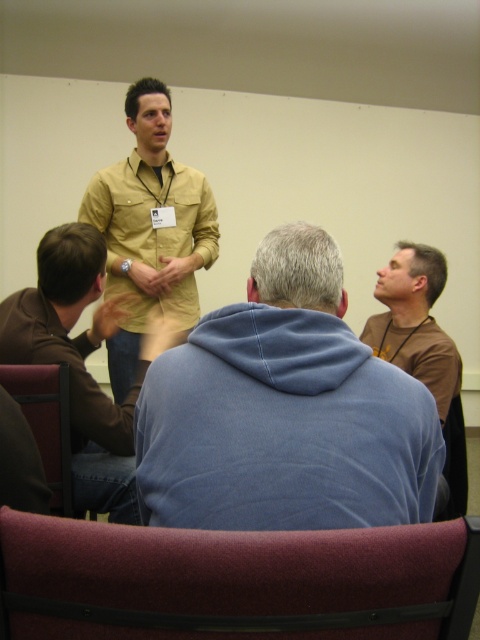
Question: Which of the following is the farthest from the observer?

Choices:
 (A) (22, 394)
 (B) (197, 362)
 (C) (443, 433)

Answer: (C)

Question: Can you confirm if matte khaki shirt at upper center is smaller than maroon fabric chair at lower right?

Choices:
 (A) yes
 (B) no

Answer: (B)

Question: Is blue fleece jacket at center positioned behind brown matte shirt at upper right?

Choices:
 (A) yes
 (B) no

Answer: (B)

Question: Is brown leather jacket at upper left behind brown matte shirt at upper right?

Choices:
 (A) no
 (B) yes

Answer: (A)

Question: Which object appears closest to the camera in this image?

Choices:
 (A) blue fleece jacket at center
 (B) maroon fabric chair at lower right
 (C) matte khaki shirt at upper center

Answer: (A)

Question: Which point is farther from the camera taking this photo?

Choices:
 (A) (436, 461)
 (B) (372, 593)
 (C) (407, 276)

Answer: (C)